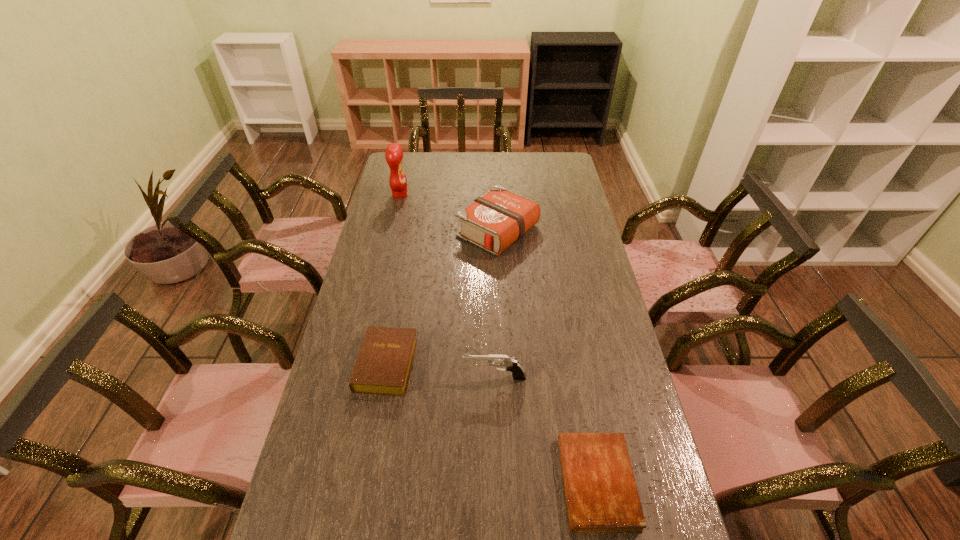
I want to click on free space between the gun and the condiment, so click(447, 286).

Where is `free space between the shortest object and the gun`? free space between the shortest object and the gun is located at coordinates (545, 430).

At what (x,y) coordinates should I click in order to perform the action: click on vacant area that lies between the leftmost Bible and the gun. Please return your answer as a coordinate pair (x, y). The height and width of the screenshot is (540, 960). Looking at the image, I should click on (441, 371).

I want to click on vacant point located between the farthest Bible and the gun, so click(496, 304).

This screenshot has width=960, height=540. I want to click on free point between the second farthest object and the second farthest Bible, so click(x=442, y=298).

Point out which object is positioned as the second nearest to the nearest Bible. Please provide its 2D coordinates. Your answer should be formatted as a tuple, i.e. [(x, y)], where the tuple contains the x and y coordinates of a point satisfying the conditions above.

[(383, 366)]

Point out which object is positioned as the nearest to the shortest Bible. Please provide its 2D coordinates. Your answer should be formatted as a tuple, i.e. [(x, y)], where the tuple contains the x and y coordinates of a point satisfying the conditions above.

[(511, 364)]

I want to click on Bible that stands as the third closest to the condiment, so click(x=601, y=493).

Point out which Bible is positioned as the second nearest to the fourth tallest object. Please provide its 2D coordinates. Your answer should be formatted as a tuple, i.e. [(x, y)], where the tuple contains the x and y coordinates of a point satisfying the conditions above.

[(601, 493)]

This screenshot has height=540, width=960. What are the coordinates of `vacant space that satisfies the following two spatial constraints: 1. on the label side of the condiment; 2. on the right side of the second farthest Bible` in the screenshot? It's located at (361, 364).